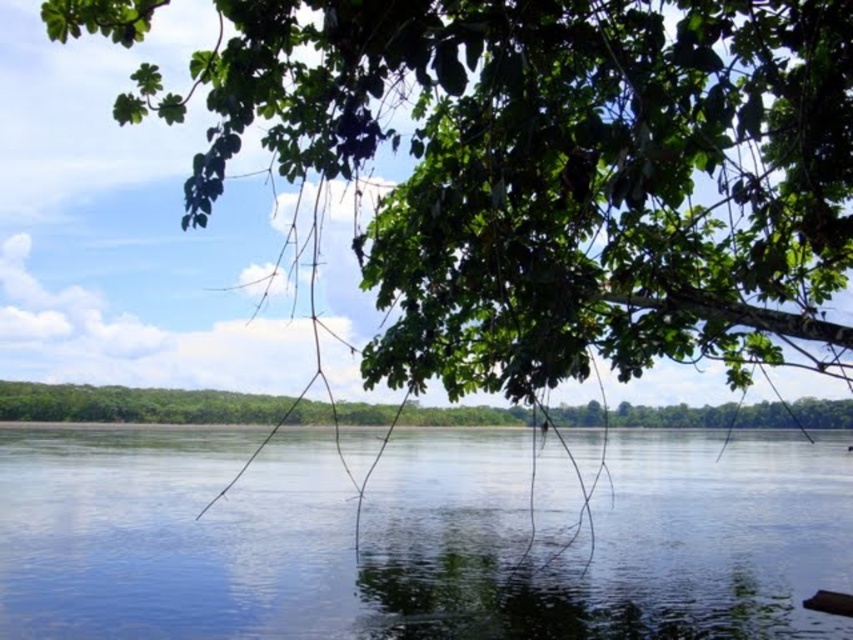
Question: Among these objects, which one is farthest from the camera?

Choices:
 (A) green leafy tree at center
 (B) green leafy tree at upper center
 (C) transparent water at center

Answer: (A)

Question: Which point is farther to the camera?

Choices:
 (A) green leafy tree at center
 (B) transparent water at center
 (C) green leafy tree at upper center

Answer: (A)

Question: Does green leafy tree at upper center appear on the left side of green leafy tree at center?

Choices:
 (A) yes
 (B) no

Answer: (B)

Question: Can you confirm if transparent water at center is positioned to the right of green leafy tree at center?

Choices:
 (A) no
 (B) yes

Answer: (B)

Question: Among these points, which one is nearest to the camera?

Choices:
 (A) (267, 138)
 (B) (775, 532)
 (C) (749, 404)

Answer: (A)

Question: Is green leafy tree at upper center wider than transparent water at center?

Choices:
 (A) no
 (B) yes

Answer: (A)